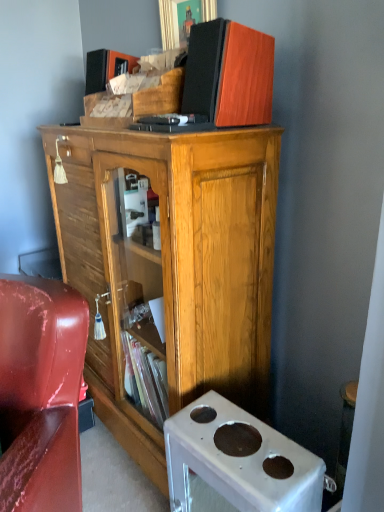
The image size is (384, 512). I want to click on wooden cabinet at center, so click(x=173, y=265).

Is wooden speaker at upper center surrounding glossy leather chair at lower left?

No, glossy leather chair at lower left is not inside wooden speaker at upper center.

Is wooden speaker at upper center positioned far away from glossy leather chair at lower left?

No, wooden speaker at upper center is not far away from glossy leather chair at lower left.

Is wooden speaker at upper center behind glossy leather chair at lower left?

Yes, wooden speaker at upper center is further from the viewer.

The image size is (384, 512). In order to click on cabinetry in front of the wooden speaker at upper center in this screenshot , I will do coord(173,265).

Does wooden speaker at upper center touch wooden cabinet at center?

No.

From a real-world perspective, is wooden speaker at upper center below wooden cabinet at center?

Incorrect, from a real-world perspective, wooden speaker at upper center is higher than wooden cabinet at center.

Which is in front, wooden speaker at upper center or wooden cabinet at center?

wooden cabinet at center is closer to the camera.

How different are the orientations of white plastic desk at lower right and glossy leather chair at lower left in degrees?

The angular difference between white plastic desk at lower right and glossy leather chair at lower left is 40.9 degrees.

From the image's perspective, relative to glossy leather chair at lower left, is white plastic desk at lower right above or below?

white plastic desk at lower right is below glossy leather chair at lower left.

Considering the sizes of objects white plastic desk at lower right and glossy leather chair at lower left in the image provided, who is taller, white plastic desk at lower right or glossy leather chair at lower left?

Standing taller between the two is glossy leather chair at lower left.

Is glossy leather chair at lower left at the back of white plastic desk at lower right?

No.

Is wooden cabinet at center turned away from wooden speaker at upper center?

No, wooden cabinet at center is not facing away from wooden speaker at upper center.

Is wooden cabinet at center wider or thinner than wooden speaker at upper center?

Considering their sizes, wooden cabinet at center looks broader than wooden speaker at upper center.

Between point (155, 431) and point (253, 73), which one is positioned in front?

The point (253, 73) is closer.

From the picture: Is wooden speaker at upper center shorter than white plastic desk at lower right?

Correct, wooden speaker at upper center is not as tall as white plastic desk at lower right.

Looking at their sizes, would you say wooden speaker at upper center is wider or thinner than white plastic desk at lower right?

wooden speaker at upper center is wider than white plastic desk at lower right.

How distant is wooden speaker at upper center from white plastic desk at lower right?

The distance of wooden speaker at upper center from white plastic desk at lower right is 33.99 inches.

From the image's perspective, is wooden speaker at upper center located above white plastic desk at lower right?

Yes.

Is glossy leather chair at lower left aimed at wooden cabinet at center?

No, glossy leather chair at lower left is not facing towards wooden cabinet at center.

Which object is positioned more to the right, glossy leather chair at lower left or wooden cabinet at center?

From the viewer's perspective, wooden cabinet at center appears more on the right side.

Considering the sizes of glossy leather chair at lower left and wooden cabinet at center in the image, is glossy leather chair at lower left wider or thinner than wooden cabinet at center?

glossy leather chair at lower left is wider than wooden cabinet at center.

From the image's perspective, is glossy leather chair at lower left over wooden cabinet at center?

Actually, glossy leather chair at lower left appears below wooden cabinet at center in the image.

Who is taller, wooden cabinet at center or glossy leather chair at lower left?

Standing taller between the two is wooden cabinet at center.

From a real-world perspective, between wooden cabinet at center and glossy leather chair at lower left, who is vertically higher?

wooden cabinet at center is physically above.

How different are the orientations of wooden cabinet at center and glossy leather chair at lower left in degrees?

wooden cabinet at center and glossy leather chair at lower left are facing 45.1 degrees away from each other.

This screenshot has width=384, height=512. What are the coordinates of `book on the right of the glossy leather chair at lower left` in the screenshot? It's located at (229, 74).

Locate an element on the screen. The image size is (384, 512). book behind the wooden cabinet at center is located at coordinates (229, 74).

Which object lies further to the anchor point white plastic desk at lower right, glossy leather chair at lower left or wooden cabinet at center?

Based on the image, wooden cabinet at center appears to be further to white plastic desk at lower right.

From the image, which object appears to be nearer to wooden speaker at upper center, white plastic desk at lower right or glossy leather chair at lower left?

glossy leather chair at lower left lies closer to wooden speaker at upper center than the other object.

Considering their positions, is white plastic desk at lower right positioned closer to glossy leather chair at lower left than wooden cabinet at center?

Among the two, white plastic desk at lower right is located nearer to glossy leather chair at lower left.

Looking at this image, considering their positions, is wooden speaker at upper center positioned further to white plastic desk at lower right than wooden cabinet at center?

wooden speaker at upper center.

From the image, which object appears to be nearer to wooden cabinet at center, wooden speaker at upper center or glossy leather chair at lower left?

wooden speaker at upper center.

When comparing their distances from white plastic desk at lower right, does wooden cabinet at center or glossy leather chair at lower left seem closer?

glossy leather chair at lower left is closer to white plastic desk at lower right.

From the image, which object appears to be farther from wooden cabinet at center, white plastic desk at lower right or glossy leather chair at lower left?

Based on the image, glossy leather chair at lower left appears to be further to wooden cabinet at center.

From the image, which object appears to be farther from wooden speaker at upper center, white plastic desk at lower right or wooden cabinet at center?

Based on the image, white plastic desk at lower right appears to be further to wooden speaker at upper center.

The height and width of the screenshot is (512, 384). In order to click on cabinetry between wooden speaker at upper center and glossy leather chair at lower left from top to bottom in this screenshot , I will do `click(173, 265)`.

Identify the location of cabinetry between wooden speaker at upper center and white plastic desk at lower right vertically. This screenshot has height=512, width=384. (173, 265).

Locate an element on the screen. The image size is (384, 512). chair between wooden speaker at upper center and white plastic desk at lower right vertically is located at coordinates (40, 394).

At what (x,y) coordinates should I click in order to perform the action: click on cabinetry between glossy leather chair at lower left and white plastic desk at lower right in the horizontal direction. Please return your answer as a coordinate pair (x, y). This screenshot has width=384, height=512. Looking at the image, I should click on (173, 265).